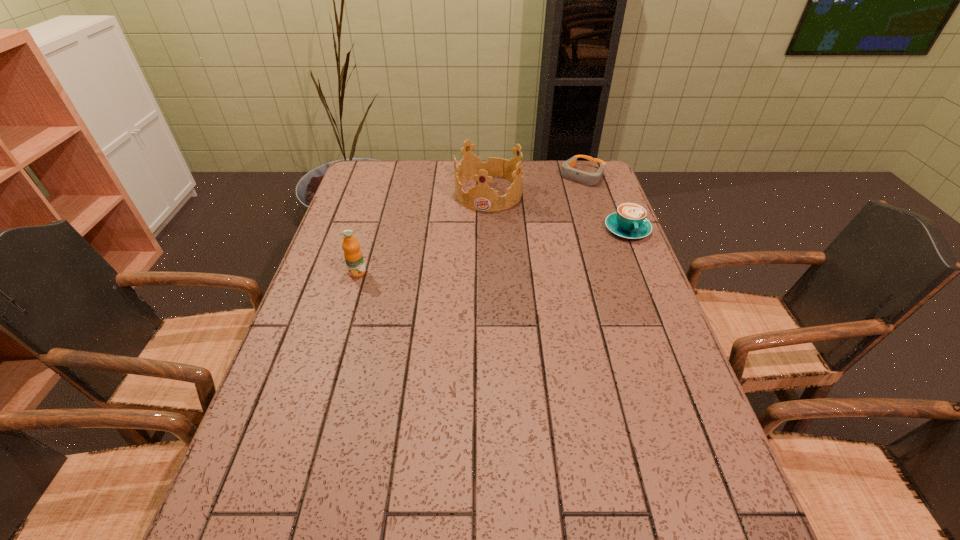
Identify the location of vacant region located 0.270m on the front and back of the goggles. This screenshot has height=540, width=960. (x=538, y=225).

Find the location of a particular element. The height and width of the screenshot is (540, 960). free space located 0.390m on the front-facing side of the tiara is located at coordinates click(x=459, y=295).

Identify the location of vacant region located 0.130m on the front-facing side of the tiara. This screenshot has height=540, width=960. (476, 236).

At what (x,y) coordinates should I click in order to perform the action: click on vacant area situated 0.200m on the front-facing side of the tiara. Please return your answer as a coordinate pair (x, y). Looking at the image, I should click on (471, 250).

The width and height of the screenshot is (960, 540). In order to click on goggles at the far edge in this screenshot , I will do `click(589, 179)`.

I want to click on tiara positioned at the far edge, so click(481, 197).

Find the location of a particular element. object located in the left edge section of the desktop is located at coordinates (353, 256).

Identify the location of cappuccino at the right edge. (630, 222).

Image resolution: width=960 pixels, height=540 pixels. I want to click on goggles that is at the right edge, so click(x=589, y=179).

Image resolution: width=960 pixels, height=540 pixels. In order to click on object at the far right corner in this screenshot , I will do `click(589, 179)`.